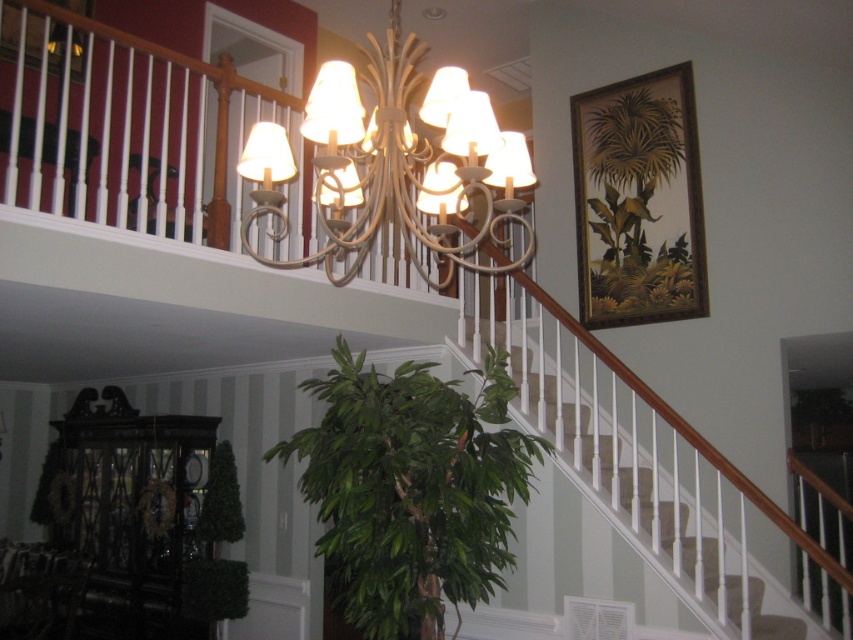
You are standing at the entrance of the two story staircase and want to reach the chandelier. Which object is closer to you, the white textured stairs at center or the white matte chandelier at upper center?

The white textured stairs at center is closer to you than the white matte chandelier at upper center because the stairs are further to the viewer, meaning they are in front of the chandelier.

You are standing in the two story staircase area and want to know which of the two points, point (541,429) or point (642,125), is closer to you. Which one is closer?

Point (541,429) is closer to the camera than point (642,125), so it is closer to you.